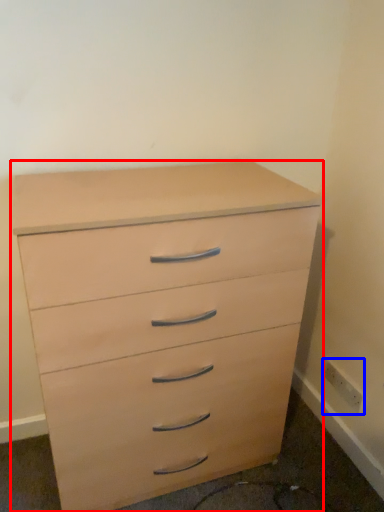
Question: Which of the following is the closest to the observer, chest of drawers (highlighted by a red box) or electric outlet (highlighted by a blue box)?

Choices:
 (A) chest of drawers
 (B) electric outlet

Answer: (A)